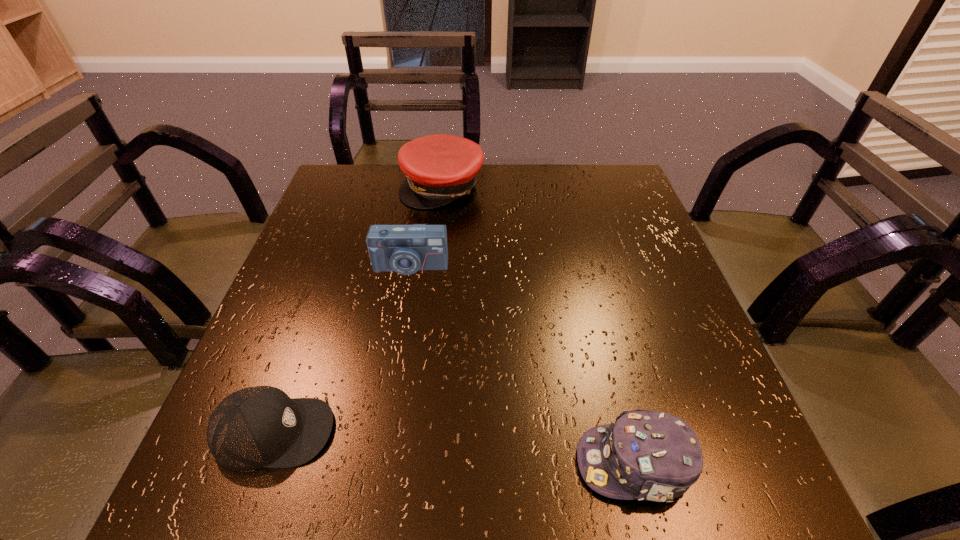
Where is `the farthest object`? The width and height of the screenshot is (960, 540). the farthest object is located at coordinates (440, 168).

At what (x,y) coordinates should I click in order to perform the action: click on the farthest headwear. Please return your answer as a coordinate pair (x, y). Image resolution: width=960 pixels, height=540 pixels. Looking at the image, I should click on (440, 168).

The width and height of the screenshot is (960, 540). I want to click on the second farthest object, so click(405, 249).

The height and width of the screenshot is (540, 960). I want to click on the leftmost headwear, so click(x=255, y=427).

Where is `the rightmost headwear`? Image resolution: width=960 pixels, height=540 pixels. the rightmost headwear is located at coordinates (646, 455).

This screenshot has height=540, width=960. I want to click on vacant point located on the front-facing side of the second headwear from left to right, so click(x=437, y=237).

Identify the location of vacant space located 0.230m on the lens of the camera. click(393, 366).

In order to click on free space located 0.140m on the front-facing side of the leftmost headwear in this screenshot , I will do `click(420, 433)`.

Identify the location of vacant space located 0.300m on the front-facing side of the rightmost object. Image resolution: width=960 pixels, height=540 pixels. (378, 463).

Identify the location of free region located 0.320m on the front-facing side of the rightmost object. The width and height of the screenshot is (960, 540). (365, 463).